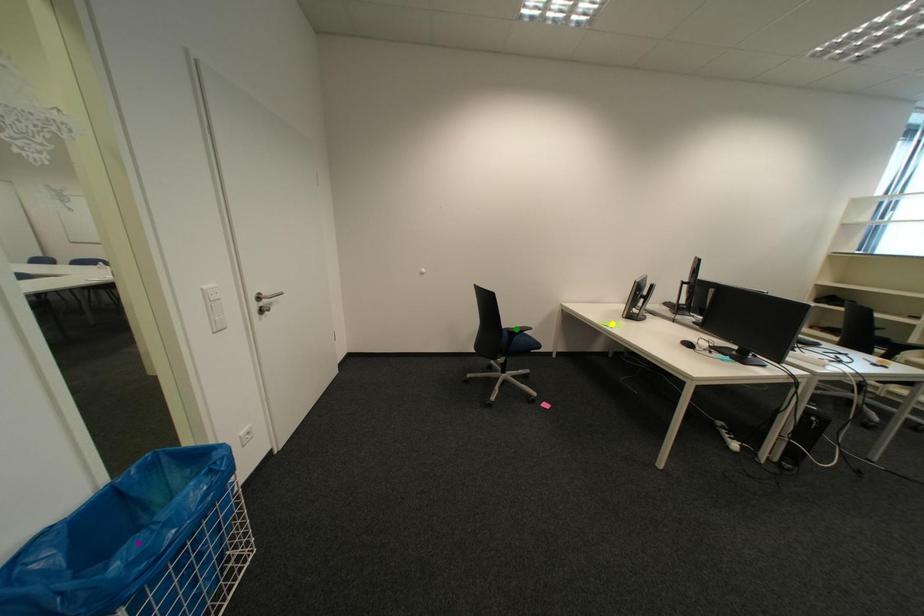
Order these from nearest to farthest:
purple point, yellow point, green point

purple point < green point < yellow point